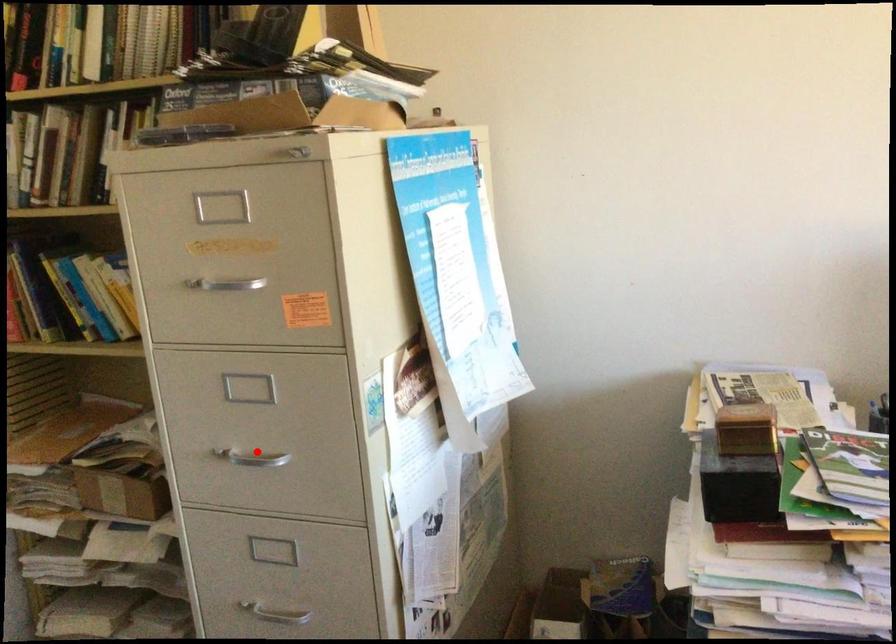
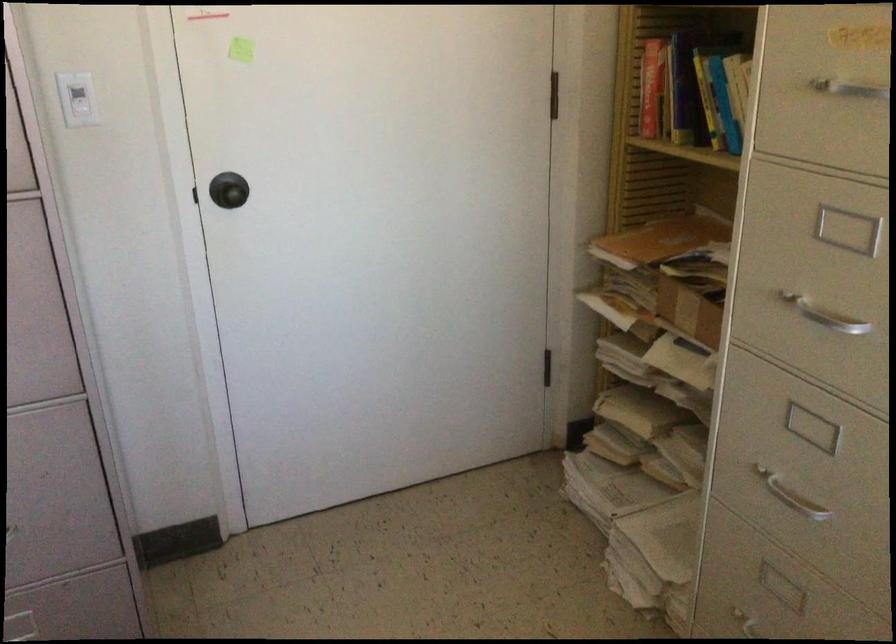
Question: I am providing you with two images of the same scene from different viewpoints. A red point is shown in image1. For the corresponding object point in image2, is it positioned nearer or farther from the camera?

Choices:
 (A) Nearer
 (B) Farther

Answer: (A)